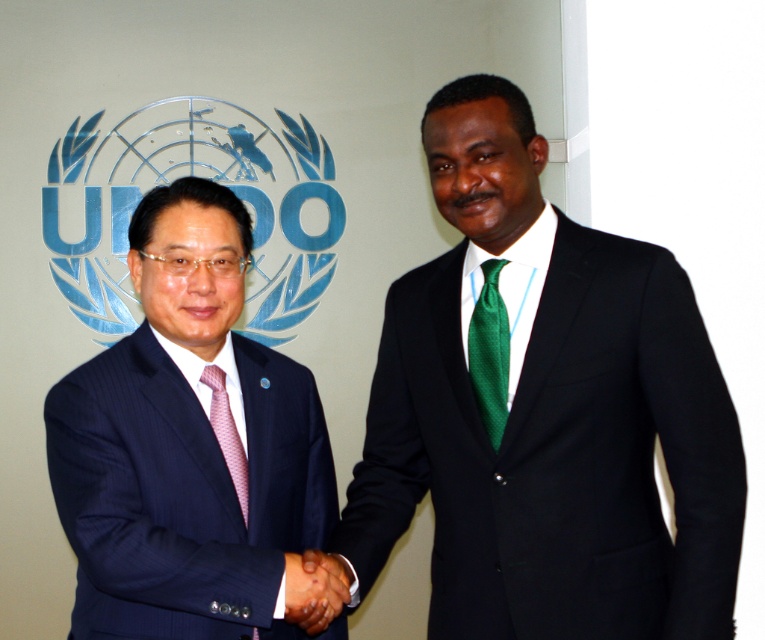
Question: Can you confirm if shiny black suit at center is positioned below pink dotted tie at left?

Choices:
 (A) yes
 (B) no

Answer: (B)

Question: Among these objects, which one is farthest from the camera?

Choices:
 (A) shiny black suit at center
 (B) matte black suit at left
 (C) pink dotted tie at left
 (D) dark brown leather hand at center

Answer: (C)

Question: Which object is farther from the camera taking this photo?

Choices:
 (A) matte black suit at left
 (B) dark brown leather hand at center

Answer: (B)

Question: Is matte black suit at left below pink dotted tie at left?

Choices:
 (A) no
 (B) yes

Answer: (A)

Question: Is matte black suit at left wider than pink dotted tie at left?

Choices:
 (A) yes
 (B) no

Answer: (A)

Question: Which point is closer to the camera?

Choices:
 (A) green textured tie at center
 (B) matte black suit at left
 (C) pink dotted tie at left
 (D) shiny black suit at center

Answer: (D)